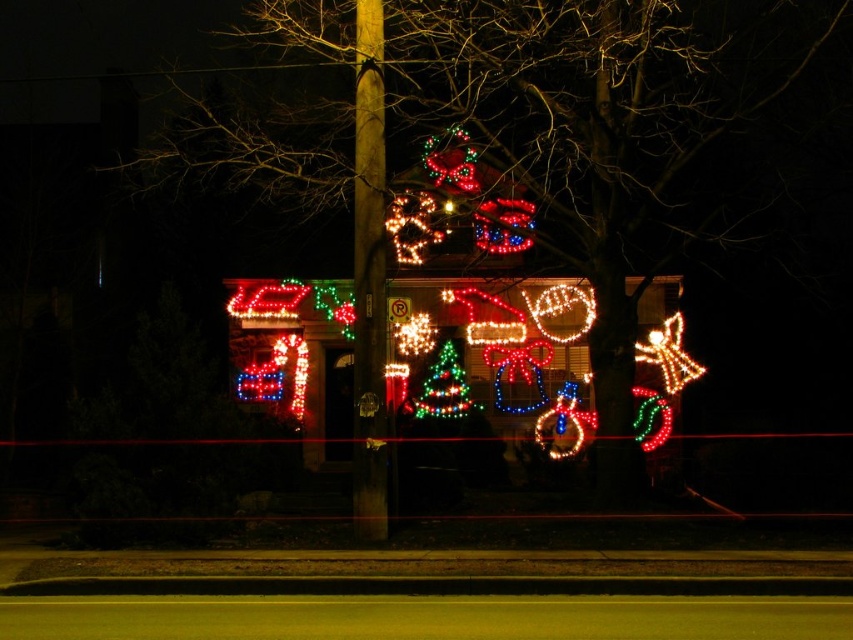
Which is more to the left, illuminated lights at center or smooth wooden pole at center?

illuminated lights at center is more to the left.

Between illuminated lights at center and smooth wooden pole at center, which one has more height?

With more height is illuminated lights at center.

Who is more distant from viewer, (647,211) or (358,236)?

Point (647,211)

Identify the location of illuminated lights at center. (534, 131).

Between illuminated lights at center and green matte christmas tree at center, which one has more height?

illuminated lights at center is taller.

Find the location of a particular element. illuminated lights at center is located at coordinates (534, 131).

In the scene shown: Who is more forward, (751, 76) or (416, 403)?

Point (751, 76) is in front.

The image size is (853, 640). Find the location of `illuminated lights at center`. illuminated lights at center is located at coordinates (534, 131).

Who is taller, smooth wooden pole at center or green matte christmas tree at center?

With more height is smooth wooden pole at center.

Does point (378, 216) come behind point (426, 376)?

No.

Locate an element on the screen. smooth wooden pole at center is located at coordinates (369, 278).